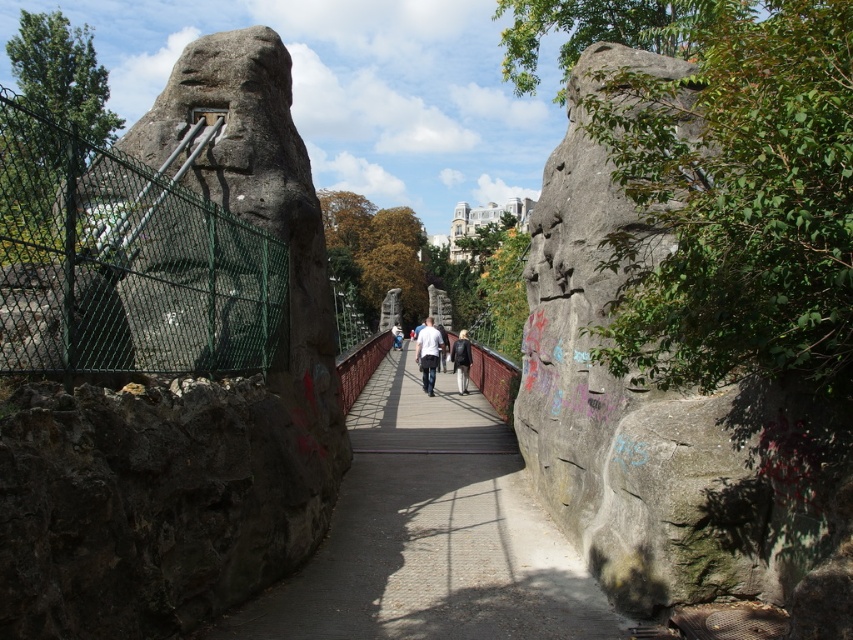
Question: Can you confirm if white matte shirt at center is positioned to the left of white cotton shirt at center?

Choices:
 (A) no
 (B) yes

Answer: (A)

Question: Which object appears closest to the camera in this image?

Choices:
 (A) dark gray stone rock at left
 (B) white matte shirt at center

Answer: (A)

Question: Which point is farther to the camera?

Choices:
 (A) (457, 360)
 (B) (401, 332)
 (C) (302, 456)
 (D) (432, 326)

Answer: (B)

Question: Which object appears farthest from the camera in this image?

Choices:
 (A) white cotton shirt at center
 (B) dark gray stone rock at left
 (C) wooden bridge at center

Answer: (A)

Question: Can you confirm if white matte shirt at center is positioned below white cotton shirt at center?

Choices:
 (A) no
 (B) yes

Answer: (B)

Question: Does wooden bridge at center appear on the right side of white cotton shirt at center?

Choices:
 (A) yes
 (B) no

Answer: (A)